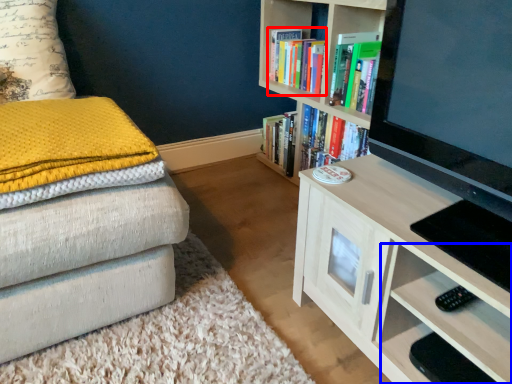
Question: Which object is closer to the camera taking this photo, book (highlighted by a red box) or drawer (highlighted by a blue box)?

Choices:
 (A) book
 (B) drawer

Answer: (B)